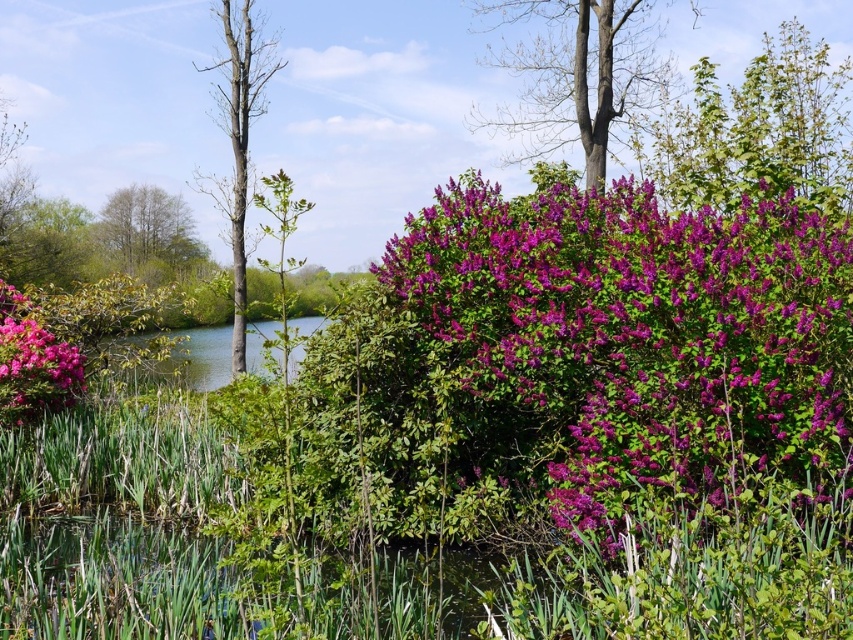
Does smooth bark tree at upper center appear over bare wood tree at left?

Yes, smooth bark tree at upper center is above bare wood tree at left.

What do you see at coordinates (575, 74) in the screenshot? I see `smooth bark tree at upper center` at bounding box center [575, 74].

Image resolution: width=853 pixels, height=640 pixels. Identify the location of smooth bark tree at upper center. (575, 74).

Which of these two, smooth bark tree at upper center or matte pink flower at lower left, stands shorter?

With less height is matte pink flower at lower left.

Who is more distant from viewer, (x=576, y=122) or (x=45, y=401)?

The point (x=576, y=122) is more distant.

Does point (567, 116) lie in front of point (26, 413)?

No, it is behind (26, 413).

This screenshot has height=640, width=853. In order to click on smooth bark tree at upper center in this screenshot , I will do [x=575, y=74].

Is purple glossy bush at center wider than bare wood tree at left?

Incorrect, purple glossy bush at center's width does not surpass bare wood tree at left's.

Does purple glossy bush at center appear over bare wood tree at left?

Actually, purple glossy bush at center is below bare wood tree at left.

Who is more distant from viewer, (x=817, y=326) or (x=257, y=38)?

The point (x=257, y=38) is more distant.

Find the location of `purple glossy bush at center`. purple glossy bush at center is located at coordinates (641, 337).